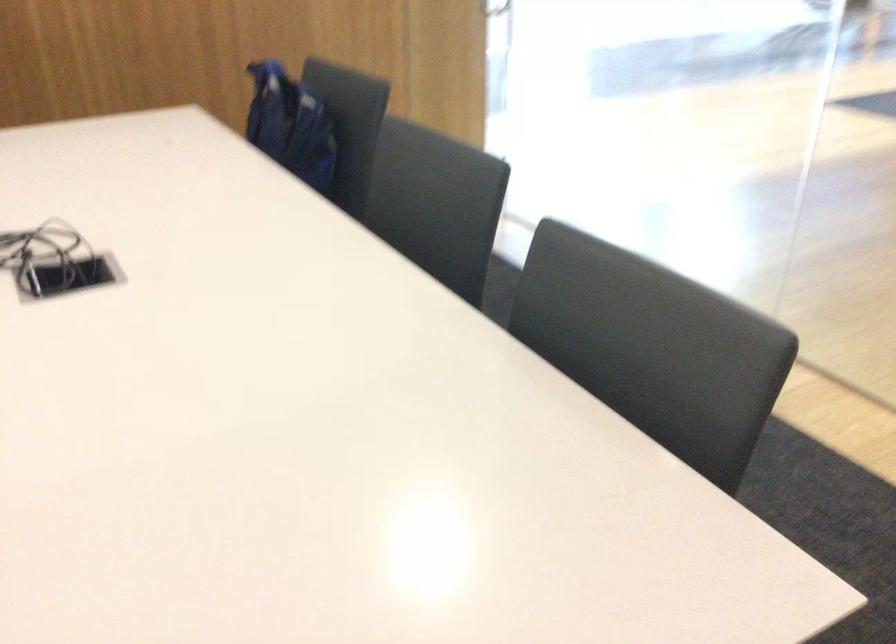
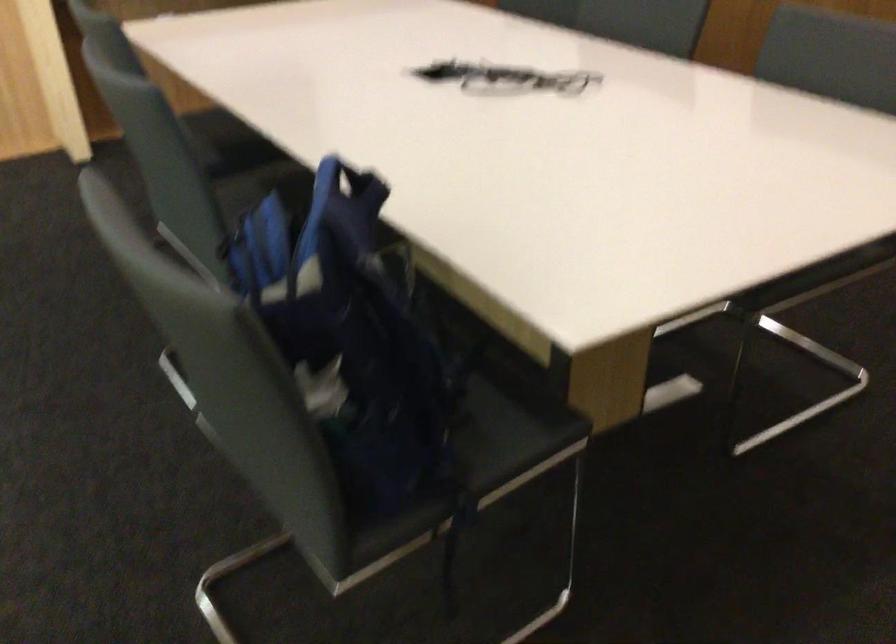
The point at (269,78) is marked in the first image. Where is the corresponding point in the second image?

(349, 184)